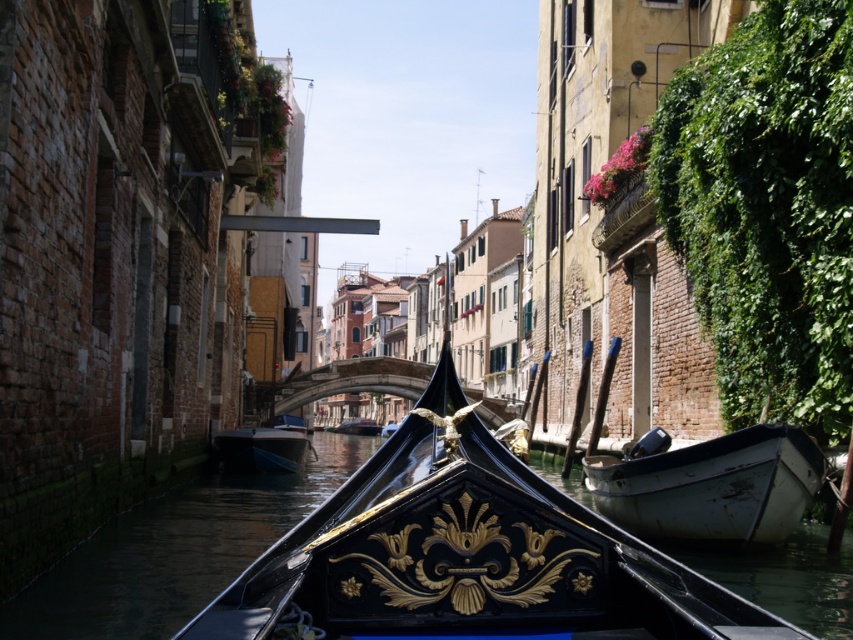
Find the location of a particular element. This screenshot has height=640, width=853. rusty metal dinghy at lower right is located at coordinates (712, 486).

From the picture: Which of these two, rusty metal dinghy at lower right or black polished wood boat at center, stands shorter?

Standing shorter between the two is black polished wood boat at center.

Measure the distance between point (x=737, y=452) and camera.

A distance of 50.70 meters exists between point (x=737, y=452) and camera.

Find the location of a particular element. rusty metal dinghy at lower right is located at coordinates (712, 486).

Does black polished wood gondola at center appear on the left side of black polished wood boat at center?

Incorrect, black polished wood gondola at center is not on the left side of black polished wood boat at center.

Is point (361, 470) closer to viewer compared to point (339, 422)?

Yes, it is.

Where is `black polished wood gondola at center`? black polished wood gondola at center is located at coordinates (467, 556).

Does black polished wood gondola at center have a lesser height compared to rusty metal dinghy at lower right?

Incorrect, black polished wood gondola at center's height does not fall short of rusty metal dinghy at lower right's.

Can you confirm if black polished wood gondola at center is thinner than rusty metal dinghy at lower right?

In fact, black polished wood gondola at center might be wider than rusty metal dinghy at lower right.

Is point (410, 561) farther from camera compared to point (695, 506)?

No.

Identify the location of black polished wood gondola at center. (467, 556).